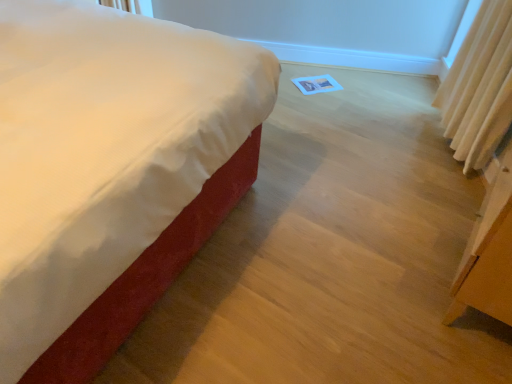
What do you see at coordinates (479, 87) in the screenshot?
I see `beige fabric curtain at right` at bounding box center [479, 87].

Locate an element on the screen. Image resolution: width=512 pixels, height=384 pixels. beige fabric curtain at right is located at coordinates (479, 87).

Describe the element at coordinates (108, 156) in the screenshot. This screenshot has height=384, width=512. I see `satin white bed at center` at that location.

The height and width of the screenshot is (384, 512). What are the coordinates of `satin white bed at center` in the screenshot? It's located at (108, 156).

What are the coordinates of `beige fabric curtain at right` in the screenshot? It's located at (479, 87).

Is satin white bed at center at the right side of beige fabric curtain at right?

In fact, satin white bed at center is to the left of beige fabric curtain at right.

Which object is further away from the camera, satin white bed at center or beige fabric curtain at right?

beige fabric curtain at right is further from the camera.

Which point is more forward, (105, 18) or (488, 35)?

The point (105, 18) is closer to the camera.

From the image's perspective, is satin white bed at center positioned above or below beige fabric curtain at right?

Based on their image positions, satin white bed at center is located beneath beige fabric curtain at right.

From a real-world perspective, relative to beige fabric curtain at right, is satin white bed at center vertically above or below?

satin white bed at center is situated higher than beige fabric curtain at right in the real world.

In terms of width, does satin white bed at center look wider or thinner when compared to beige fabric curtain at right?

Clearly, satin white bed at center has more width compared to beige fabric curtain at right.

Considering the relative sizes of satin white bed at center and beige fabric curtain at right in the image provided, is satin white bed at center taller than beige fabric curtain at right?

Indeed, satin white bed at center has a greater height compared to beige fabric curtain at right.

Can you confirm if satin white bed at center is bigger than beige fabric curtain at right?

Yes, satin white bed at center is bigger than beige fabric curtain at right.

Which is correct: satin white bed at center is inside beige fabric curtain at right, or outside of it?

satin white bed at center is not enclosed by beige fabric curtain at right.

Is satin white bed at center with beige fabric curtain at right?

No, satin white bed at center is not touching beige fabric curtain at right.

Is satin white bed at center turned away from beige fabric curtain at right?

No, satin white bed at center is not facing the opposite direction of beige fabric curtain at right.

In order to click on curtain that appears above the satin white bed at center (from the image's perspective) in this screenshot , I will do `click(479, 87)`.

Which object is positioned more to the right, beige fabric curtain at right or satin white bed at center?

beige fabric curtain at right.

Relative to satin white bed at center, is beige fabric curtain at right in front or behind?

beige fabric curtain at right is positioned farther from the viewer than satin white bed at center.

Which point is more forward, [498,129] or [87,73]?

The point [87,73] is closer.

From the image's perspective, is beige fabric curtain at right located above or below satin white bed at center?

Based on their image positions, beige fabric curtain at right is located above satin white bed at center.

From a real-world perspective, is beige fabric curtain at right under satin white bed at center?

Indeed, from a real-world perspective, beige fabric curtain at right is positioned beneath satin white bed at center.

Consider the image. In terms of width, does beige fabric curtain at right look wider or thinner when compared to satin white bed at center?

In the image, beige fabric curtain at right appears to be more narrow than satin white bed at center.

Does beige fabric curtain at right have a greater height compared to satin white bed at center?

In fact, beige fabric curtain at right may be shorter than satin white bed at center.

Which of these two, beige fabric curtain at right or satin white bed at center, is smaller?

With smaller size is beige fabric curtain at right.

Is beige fabric curtain at right inside the boundaries of satin white bed at center, or outside?

beige fabric curtain at right is not enclosed by satin white bed at center.

Are beige fabric curtain at right and satin white bed at center beside each other?

No, beige fabric curtain at right is not in contact with satin white bed at center.

Could you tell me if beige fabric curtain at right is facing satin white bed at center?

Yes, beige fabric curtain at right is oriented towards satin white bed at center.

How far apart are beige fabric curtain at right and satin white bed at center?

beige fabric curtain at right and satin white bed at center are 4.66 feet apart from each other.

Locate an element on the screen. The width and height of the screenshot is (512, 384). curtain above the satin white bed at center (from the image's perspective) is located at coordinates (479, 87).

The image size is (512, 384). I want to click on curtain lying above the satin white bed at center (from the image's perspective), so click(x=479, y=87).

Locate an element on the screen. Image resolution: width=512 pixels, height=384 pixels. bed in front of the beige fabric curtain at right is located at coordinates (108, 156).